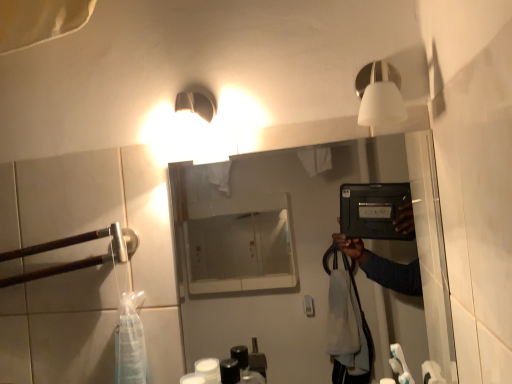
At what (x,y) coordinates should I click in order to perform the action: click on brown wood at left. Please return your answer as a coordinate pair (x, y). Image resolution: width=512 pixels, height=384 pixels. Looking at the image, I should click on (78, 260).

The image size is (512, 384). I want to click on matte black tablet at center, so click(x=278, y=289).

Based on the photo, considering the positions of objects white matte light fixture at upper right and matte black tablet at center in the image provided, who is behind, white matte light fixture at upper right or matte black tablet at center?

matte black tablet at center is more distant.

Is white matte light fixture at upper right located outside matte black tablet at center?

Yes, white matte light fixture at upper right is located beyond the bounds of matte black tablet at center.

Looking at this image, is white matte light fixture at upper right aimed at matte black tablet at center?

No, white matte light fixture at upper right does not turn towards matte black tablet at center.

Is matte black tablet at center next to brown wood at left and touching it?

No, matte black tablet at center is not in contact with brown wood at left.

Could you tell me if matte black tablet at center is turned towards brown wood at left?

No, matte black tablet at center is not turned towards brown wood at left.

Who is taller, matte black tablet at center or brown wood at left?

matte black tablet at center is taller.

Locate an element on the screen. This screenshot has width=512, height=384. door handle below the white matte light fixture at upper right (from a real-world perspective) is located at coordinates (78, 260).

Measure the distance from white matte light fixture at upper right to brown wood at left.

The distance of white matte light fixture at upper right from brown wood at left is 23.63 inches.

Relative to brown wood at left, is white matte light fixture at upper right in front or behind?

Visually, white matte light fixture at upper right is located in front of brown wood at left.

Which is more to the right, white matte light fixture at upper right or brown wood at left?

From the viewer's perspective, white matte light fixture at upper right appears more on the right side.

Is brown wood at left to the left of matte black tablet at center from the viewer's perspective?

Yes.

Which of these two, brown wood at left or matte black tablet at center, is smaller?

brown wood at left is smaller.

Is brown wood at left further to camera compared to matte black tablet at center?

Yes, it is behind matte black tablet at center.

From the image's perspective, is matte black tablet at center on top of white matte light fixture at upper right?

No, from the image's perspective, matte black tablet at center is not on top of white matte light fixture at upper right.

How different are the orientations of matte black tablet at center and white matte light fixture at upper right in degrees?

1.31 degrees separate the facing orientations of matte black tablet at center and white matte light fixture at upper right.

Is matte black tablet at center aimed at white matte light fixture at upper right?

No, matte black tablet at center is not aimed at white matte light fixture at upper right.

Which is in front, brown wood at left or white matte light fixture at upper right?

Positioned in front is white matte light fixture at upper right.

From the image's perspective, does brown wood at left appear higher than white matte light fixture at upper right?

Incorrect, from the image's perspective, brown wood at left is lower than white matte light fixture at upper right.

Measure the distance from brown wood at left to white matte light fixture at upper right.

brown wood at left is 60.01 centimeters away from white matte light fixture at upper right.

At what (x,y) coordinates should I click in order to perform the action: click on light fixture on the right of matte black tablet at center. Please return your answer as a coordinate pair (x, y). Image resolution: width=512 pixels, height=384 pixels. Looking at the image, I should click on (379, 95).

In order to click on door handle behind the matte black tablet at center in this screenshot , I will do `click(78, 260)`.

Considering their positions, is matte black tablet at center positioned further to white matte light fixture at upper right than brown wood at left?

matte black tablet at center lies further to white matte light fixture at upper right than the other object.

Looking at the image, which one is located closer to brown wood at left, white matte light fixture at upper right or matte black tablet at center?

Among the two, white matte light fixture at upper right is located nearer to brown wood at left.

Estimate the real-world distances between objects in this image. Which object is closer to matte black tablet at center, brown wood at left or white matte light fixture at upper right?

Based on the image, brown wood at left appears to be nearer to matte black tablet at center.

Which object lies nearer to the anchor point matte black tablet at center, white matte light fixture at upper right or brown wood at left?

brown wood at left lies closer to matte black tablet at center than the other object.

Looking at the image, which one is located further to white matte light fixture at upper right, brown wood at left or matte black tablet at center?

Among the two, matte black tablet at center is located further to white matte light fixture at upper right.

When comparing their distances from brown wood at left, does matte black tablet at center or white matte light fixture at upper right seem closer?

The object closer to brown wood at left is white matte light fixture at upper right.

In order to click on mirror between brown wood at left and white matte light fixture at upper right in this screenshot , I will do `click(278, 289)`.